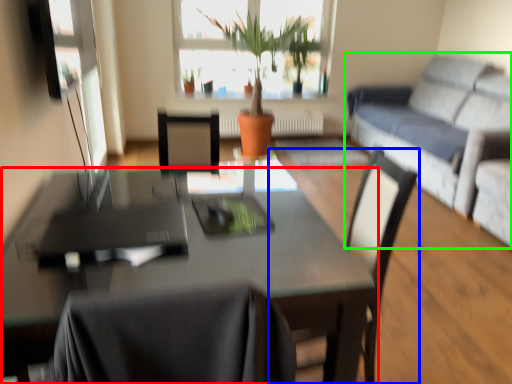
Question: Considering the real-world distances, which object is closest to table (highlighted by a red box)? chair (highlighted by a blue box) or studio couch (highlighted by a green box).

Choices:
 (A) chair
 (B) studio couch

Answer: (A)